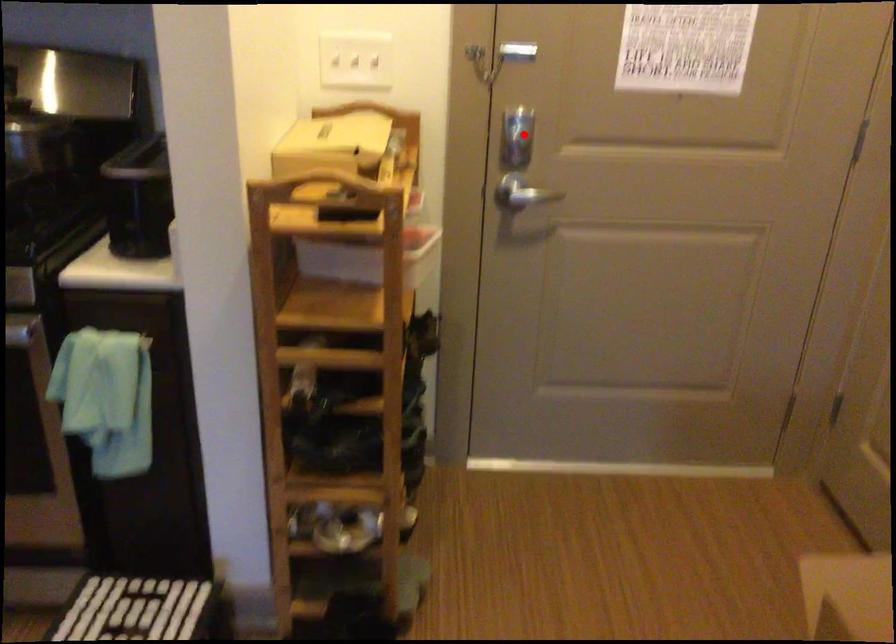
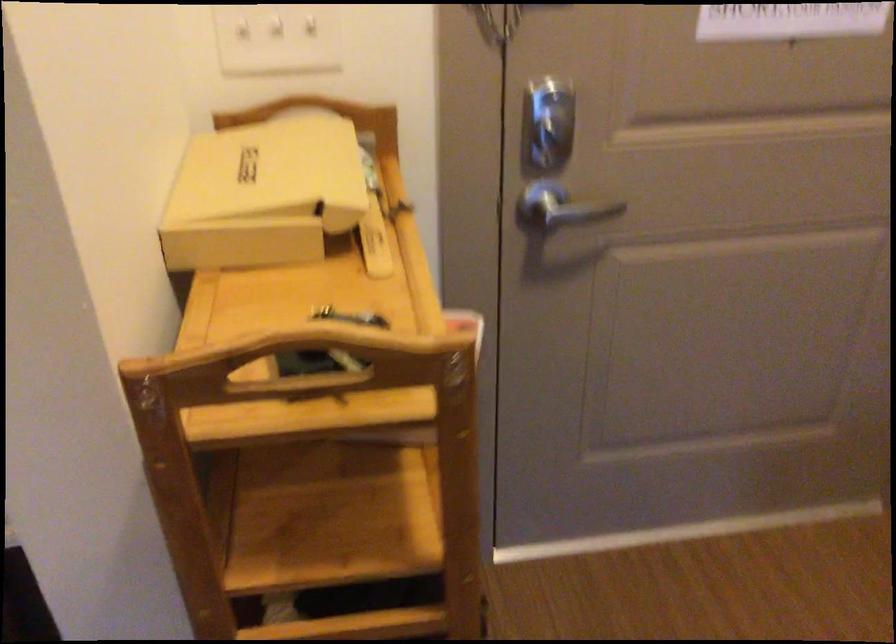
Question: I am providing you with two images of the same scene from different viewpoints. In image1, a red point is highlighted. Considering the same 3D point in image2, which of the following is correct?

Choices:
 (A) It is closer
 (B) It is farther

Answer: (A)